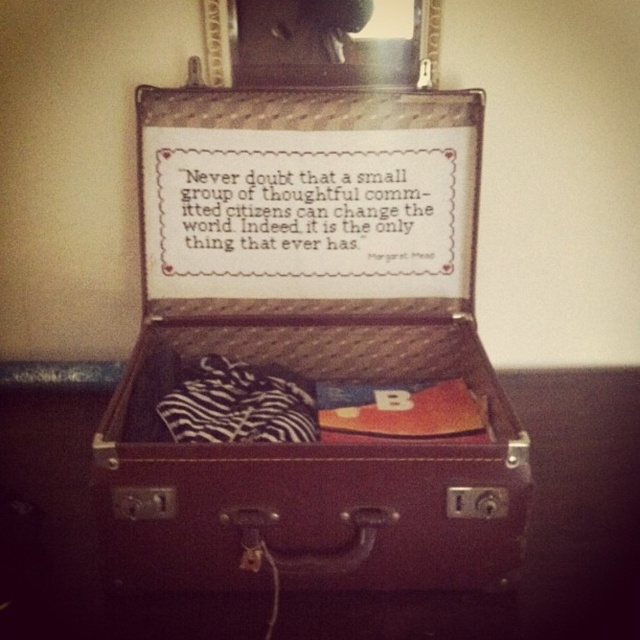
You are an interior designer who needs to place a decorative item exactly at the center of the wall. The wall is 2 meters wide. The leather suitcase at center is currently positioned at point 0.550 on the horizontal axis. Is the suitcase already centered, or does it need adjustment? Please explain.

The leather suitcase at center is located at point 0.550 on the horizontal axis. Since the wall is 2 meters wide, the exact center would be at 1 meter. The current position of 0.550 meters is 0.45 meters to the left of the center. Therefore, the suitcase needs to be moved 0.45 meters to the right to be perfectly centered.

You are a photographer taking a closeup shot of the suitcase interior. You notice two points marked as point [451,272] and point [202,426]. Which point is closer to your camera lens?

Point [451,272] is further to the camera than point [202,426], so point [202,426] is closer to the camera lens.